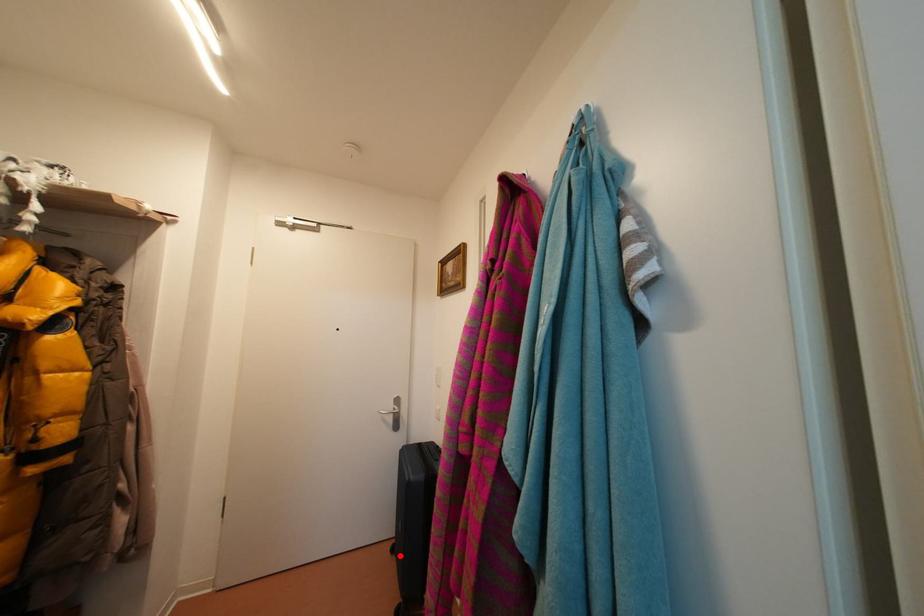
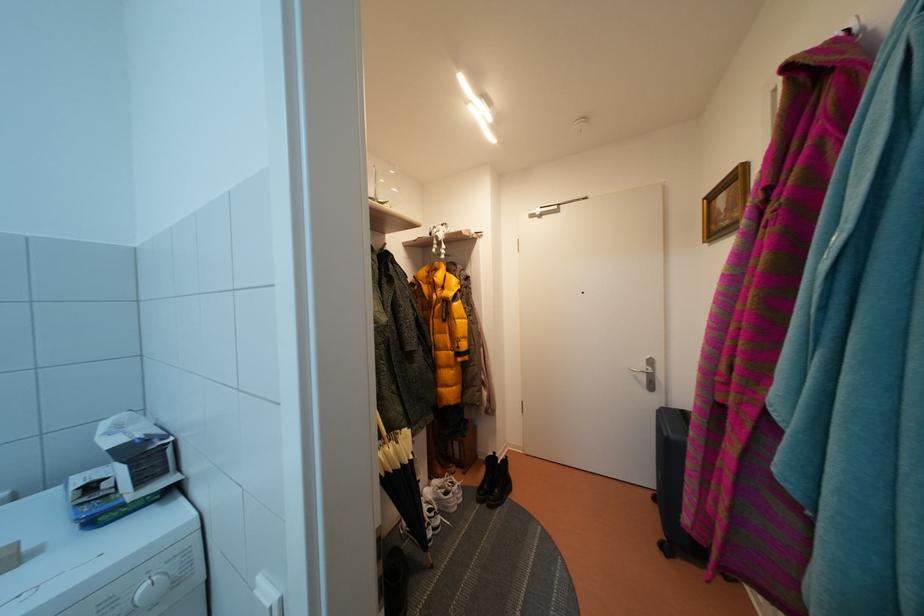
In the second image, find the point that corresponds to the highlighted location in the first image.

(662, 505)